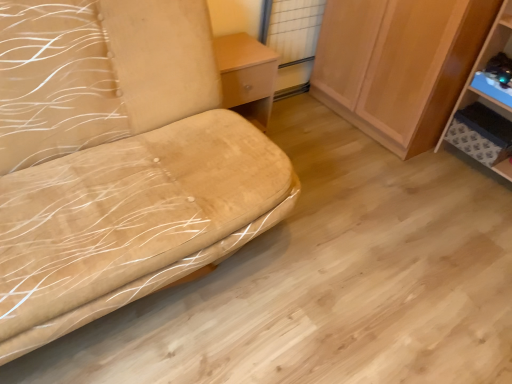
Question: From the image's perspective, would you say suede-like beige sofa at left is shown under blue plastic shelf at right?

Choices:
 (A) yes
 (B) no

Answer: (A)

Question: Considering the relative sizes of suede-like beige sofa at left and blue plastic shelf at right in the image provided, is suede-like beige sofa at left wider than blue plastic shelf at right?

Choices:
 (A) yes
 (B) no

Answer: (A)

Question: Is suede-like beige sofa at left closer to camera compared to blue plastic shelf at right?

Choices:
 (A) no
 (B) yes

Answer: (B)

Question: Can you confirm if suede-like beige sofa at left is smaller than blue plastic shelf at right?

Choices:
 (A) no
 (B) yes

Answer: (A)

Question: Considering the relative positions of suede-like beige sofa at left and blue plastic shelf at right in the image provided, is suede-like beige sofa at left to the right of blue plastic shelf at right from the viewer's perspective?

Choices:
 (A) yes
 (B) no

Answer: (B)

Question: Which is correct: blue plastic shelf at right is inside wooden cabinet at right, or outside of it?

Choices:
 (A) outside
 (B) inside

Answer: (A)

Question: In terms of width, does blue plastic shelf at right look wider or thinner when compared to wooden cabinet at right?

Choices:
 (A) thin
 (B) wide

Answer: (A)

Question: From a real-world perspective, is blue plastic shelf at right above or below wooden cabinet at right?

Choices:
 (A) below
 (B) above

Answer: (A)

Question: From the image's perspective, relative to wooden cabinet at right, is blue plastic shelf at right above or below?

Choices:
 (A) below
 (B) above

Answer: (A)

Question: From their relative heights in the image, would you say blue plastic shelf at right is taller or shorter than suede-like beige sofa at left?

Choices:
 (A) tall
 (B) short

Answer: (B)

Question: Is blue plastic shelf at right bigger or smaller than suede-like beige sofa at left?

Choices:
 (A) small
 (B) big

Answer: (A)

Question: In the image, is blue plastic shelf at right on the left side or the right side of suede-like beige sofa at left?

Choices:
 (A) right
 (B) left

Answer: (A)

Question: From a real-world perspective, is blue plastic shelf at right positioned above or below suede-like beige sofa at left?

Choices:
 (A) below
 (B) above

Answer: (A)

Question: Based on their sizes in the image, would you say wooden cabinet at right is bigger or smaller than suede-like beige sofa at left?

Choices:
 (A) big
 (B) small

Answer: (B)

Question: Is wooden cabinet at right wider or thinner than suede-like beige sofa at left?

Choices:
 (A) thin
 (B) wide

Answer: (A)